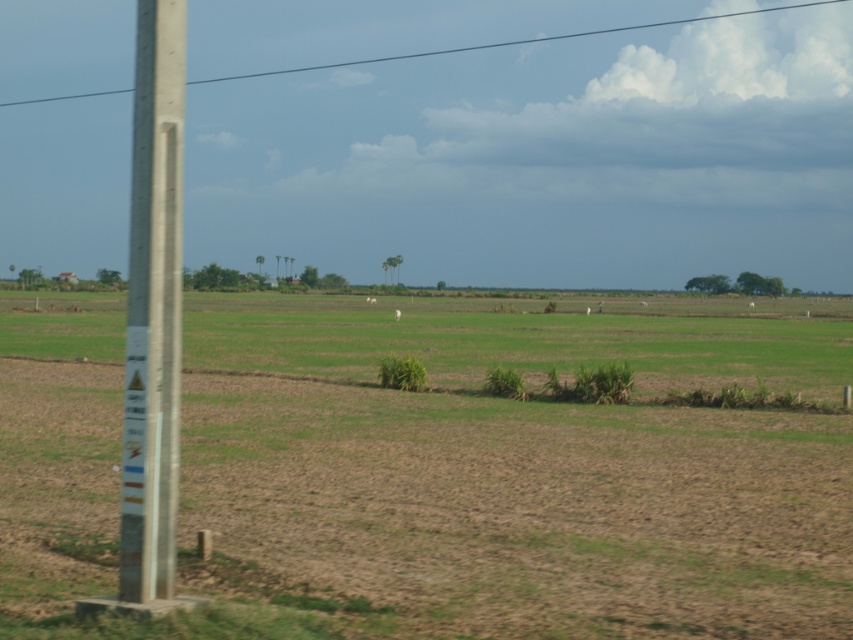
Question: Can you confirm if brown soil at center is smaller than smooth concrete power line at upper center?

Choices:
 (A) yes
 (B) no

Answer: (A)

Question: Does brown soil at center appear on the left side of concrete pole at left?

Choices:
 (A) no
 (B) yes

Answer: (A)

Question: Which object is the closest to the concrete pole at left?

Choices:
 (A) brown soil at center
 (B) smooth concrete power line at upper center

Answer: (A)

Question: Which object is positioned farthest from the smooth concrete power line at upper center?

Choices:
 (A) brown soil at center
 (B) concrete pole at left

Answer: (B)

Question: Which object is positioned farthest from the concrete pole at left?

Choices:
 (A) smooth concrete power line at upper center
 (B) brown soil at center

Answer: (A)

Question: Does brown soil at center appear on the left side of smooth concrete power line at upper center?

Choices:
 (A) yes
 (B) no

Answer: (B)